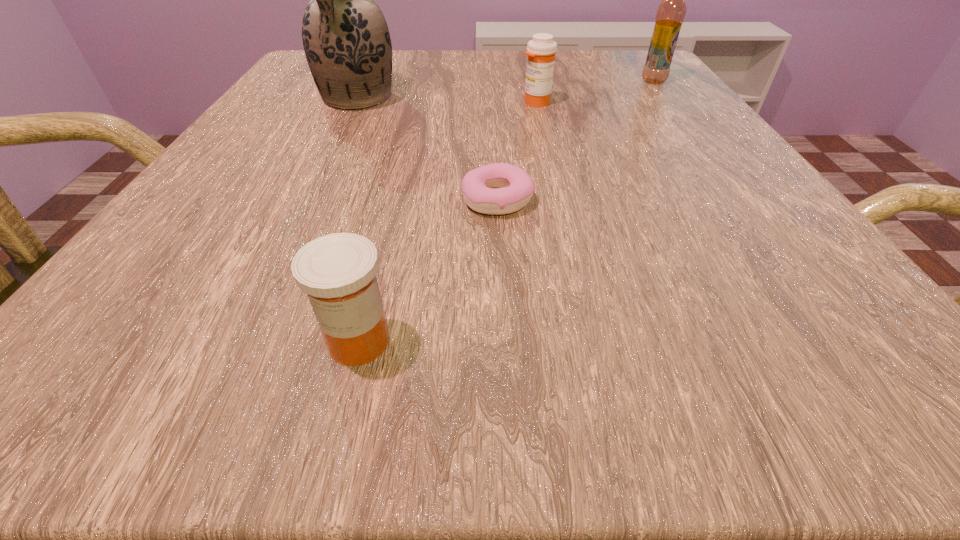
Find the location of `vacant region between the farther medicine and the second nearest object`. vacant region between the farther medicine and the second nearest object is located at coordinates (516, 151).

Locate an element on the screen. The width and height of the screenshot is (960, 540). vacant space that's between the right medicine and the second object from left to right is located at coordinates (447, 222).

Where is `free area in between the vase and the fourth object from left to right`? The image size is (960, 540). free area in between the vase and the fourth object from left to right is located at coordinates (446, 101).

This screenshot has height=540, width=960. Identify the location of vacant point located between the second nearest object and the left medicine. (428, 271).

The image size is (960, 540). Find the location of `free space between the second object from right to left and the vase`. free space between the second object from right to left and the vase is located at coordinates (446, 101).

This screenshot has width=960, height=540. What are the coordinates of `object that is the third closest to the vase` in the screenshot? It's located at (338, 271).

Identify which object is located as the third nearest to the farther medicine. Please provide its 2D coordinates. Your answer should be formatted as a tuple, i.e. [(x, y)], where the tuple contains the x and y coordinates of a point satisfying the conditions above.

[(514, 187)]

Image resolution: width=960 pixels, height=540 pixels. Identify the location of vacant space that satisfies the following two spatial constraints: 1. with the handle on the side of the vase; 2. on the right side of the third object from left to right. (308, 199).

Identify the location of vacant region that satisfies the following two spatial constraints: 1. with the handle on the side of the fourth object from left to right; 2. on the right side of the leftmost object. The image size is (960, 540). (356, 103).

In order to click on free space in the image that satisfies the following two spatial constraints: 1. on the back side of the rightmost object; 2. on the left side of the second nearest object in this screenshot , I will do `click(492, 81)`.